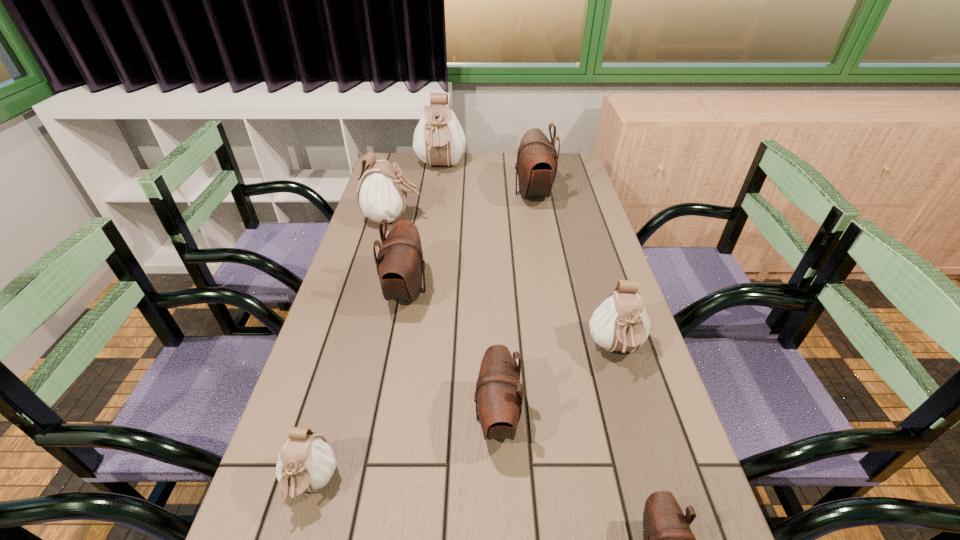
The image size is (960, 540). In order to click on object at the far left corner in this screenshot , I will do `click(438, 139)`.

Find the location of a particular element. object present at the far right corner is located at coordinates (537, 160).

In order to click on free region at the far edge in this screenshot , I will do `click(503, 154)`.

I want to click on vacant area at the left edge, so click(x=373, y=262).

Find the location of a particular element. This screenshot has width=960, height=540. free spot at the right edge of the desktop is located at coordinates (658, 445).

You are a GUI agent. You are given a task and a screenshot of the screen. Output one action in this format:
    pyautogui.click(x=<x>, y=<y>)
    Task: Click on the free region at the far right corner of the desktop
    
    Given the screenshot: What is the action you would take?
    pyautogui.click(x=564, y=156)

Find the location of a particular element. free spot between the fifth farthest pouch and the second farthest white pouch is located at coordinates (504, 284).

The width and height of the screenshot is (960, 540). Find the location of `vacant area between the fifth nearest pouch and the nearest white pouch`. vacant area between the fifth nearest pouch and the nearest white pouch is located at coordinates (359, 388).

Find the location of a particular element. free area in between the farthest brown pouch and the farthest white pouch is located at coordinates (487, 181).

I want to click on blank region between the second biggest white pouch and the farthest brown pouch, so (x=463, y=206).